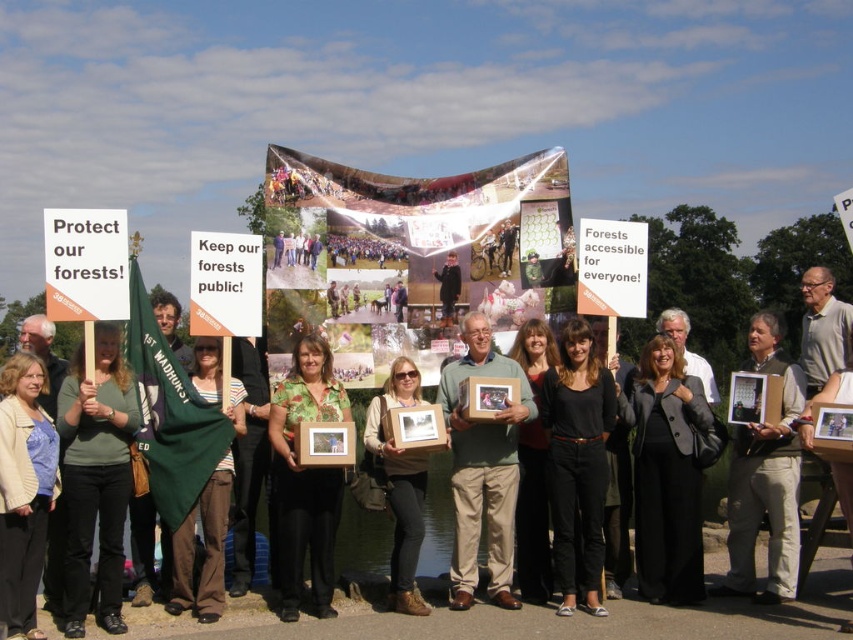
Does point (798, 486) lie behind point (448, 272)?

No.

Is khaki cotton vest at center thinner than dark gray suit at center?

No, khaki cotton vest at center is not thinner than dark gray suit at center.

Which is in front, point (791, 580) or point (454, 260)?

Point (791, 580)

This screenshot has height=640, width=853. I want to click on khaki cotton vest at center, so click(x=764, y=477).

Based on the photo, which of these two, black cotton pants at center or khaki cotton vest at center, stands taller?

khaki cotton vest at center

How far apart are black cotton pants at center and khaki cotton vest at center?

black cotton pants at center and khaki cotton vest at center are 12.95 meters apart.

Does point (572, 502) come in front of point (770, 554)?

Yes, point (572, 502) is closer to viewer.

Identify the location of black cotton pants at center. (577, 464).

From the picture: Can you confirm if green fabric flag at left is bigger than light beige sweater at center?

Yes, green fabric flag at left is bigger than light beige sweater at center.

Can you confirm if green fabric flag at left is wider than light beige sweater at center?

Indeed, green fabric flag at left has a greater width compared to light beige sweater at center.

Where is `green fabric flag at left`? The height and width of the screenshot is (640, 853). green fabric flag at left is located at coordinates (96, 481).